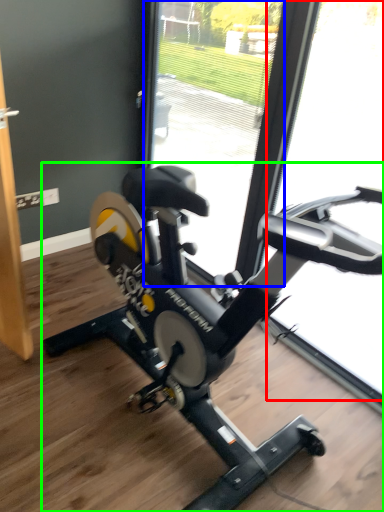
Question: Based on their relative distances, which object is nearer to glass door (highlighted by a red box)? Choose from glass door (highlighted by a blue box) and stationary bicycle (highlighted by a green box).

Choices:
 (A) glass door
 (B) stationary bicycle

Answer: (A)